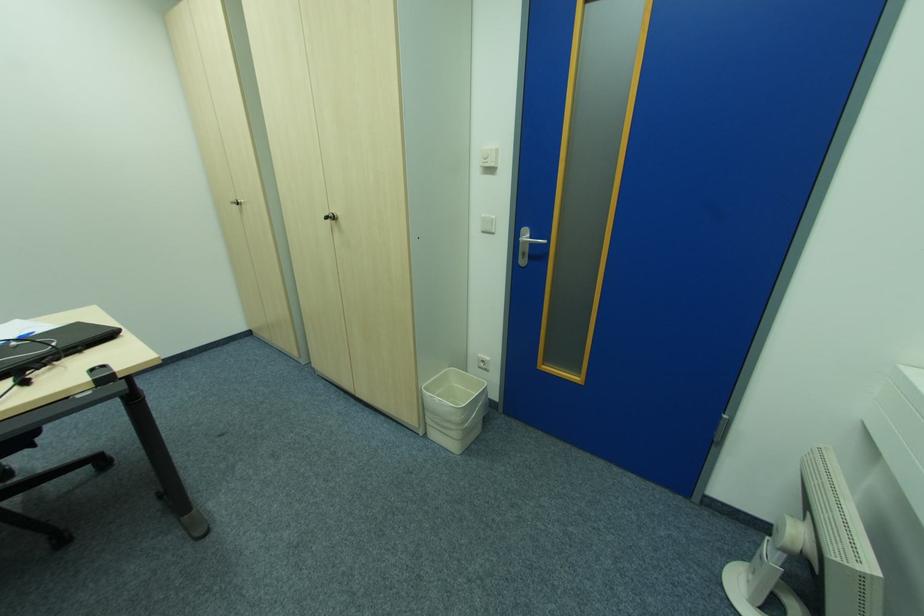
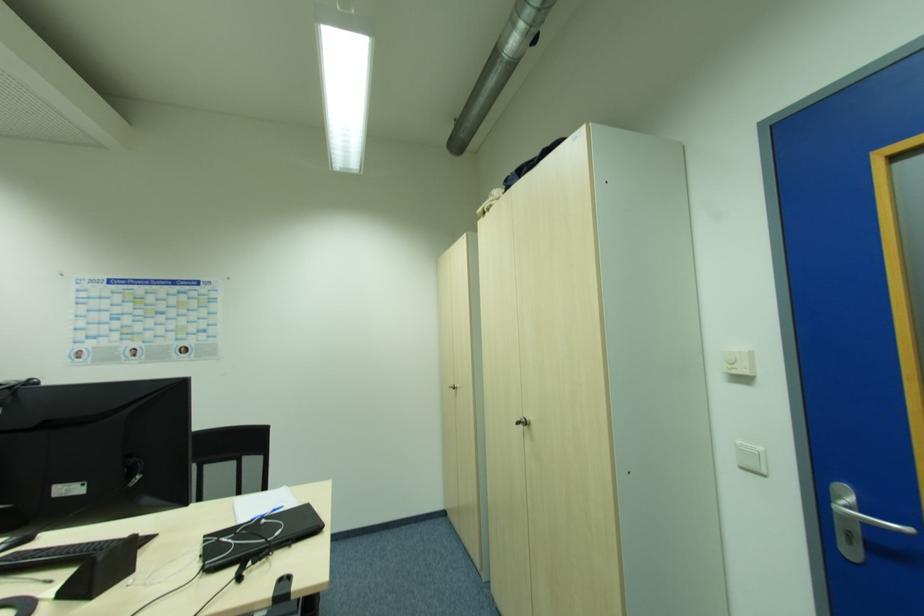
Where in the second image is the point corresponding to (334,219) from the first image?

(526, 424)